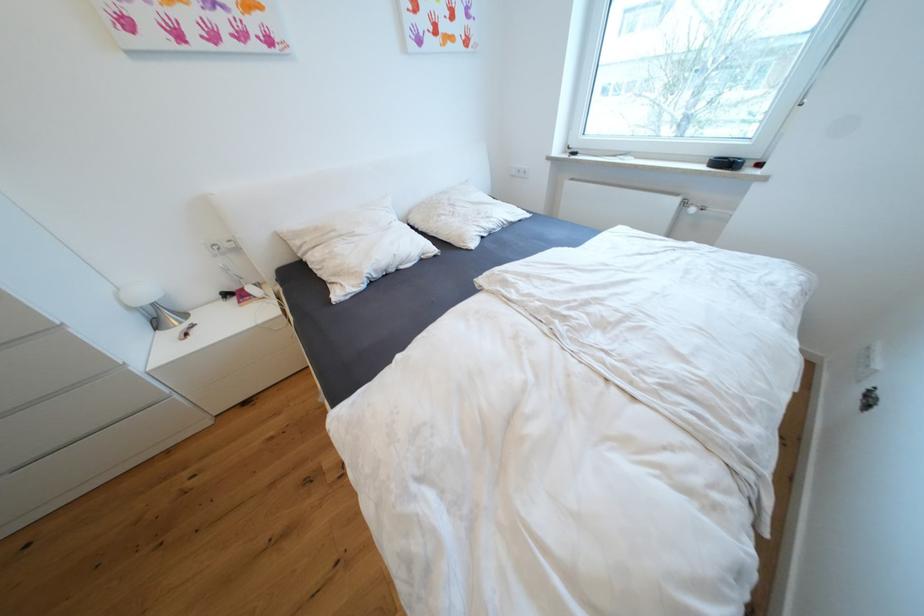
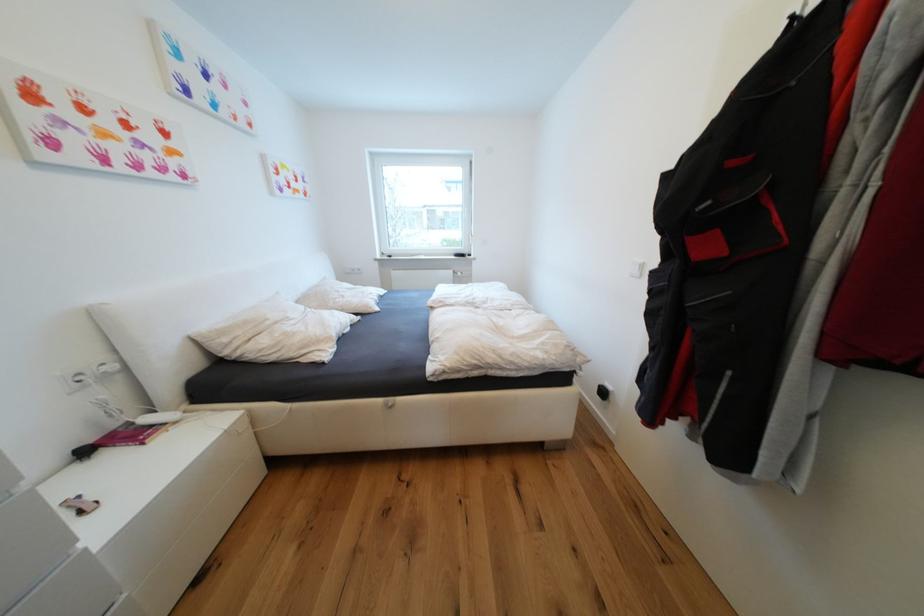
In the second image, find the point that corresponds to (x=305, y=244) in the first image.

(233, 341)